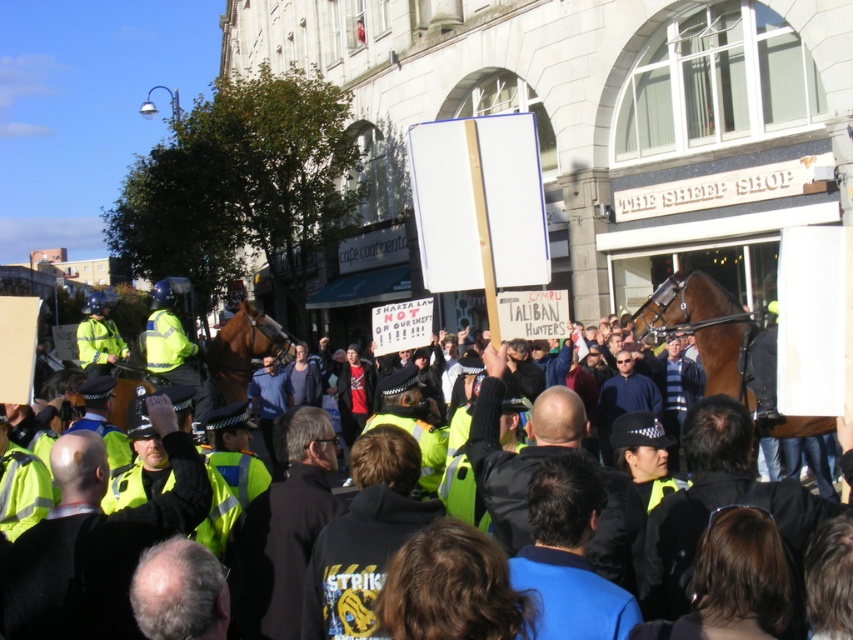
What do you see at coordinates (242, 352) in the screenshot?
I see `brown glossy horse at center` at bounding box center [242, 352].

Can you confirm if brown glossy horse at center is shorter than high-visibility yellow jacket at left?

Incorrect, brown glossy horse at center's height does not fall short of high-visibility yellow jacket at left's.

Is point (233, 392) closer to viewer compared to point (91, 312)?

Yes, it is.

This screenshot has height=640, width=853. In order to click on brown glossy horse at center in this screenshot , I will do `click(242, 352)`.

Can you confirm if dark brown leather jacket at center is positioned to the left of high-visibility yellow jacket at center-left?

In fact, dark brown leather jacket at center is to the right of high-visibility yellow jacket at center-left.

Who is more distant from viewer, (x=277, y=637) or (x=195, y=404)?

Point (x=195, y=404)

The image size is (853, 640). I want to click on dark brown leather jacket at center, so click(x=282, y=531).

Who is higher up, yellow reflective vest at center or high-visibility yellow jacket at center-left?

Positioned higher is high-visibility yellow jacket at center-left.

Is yellow reflective vest at center in front of high-visibility yellow jacket at center-left?

That is True.

What do you see at coordinates (96, 540) in the screenshot? This screenshot has width=853, height=640. I see `yellow reflective vest at center` at bounding box center [96, 540].

This screenshot has width=853, height=640. What are the coordinates of `yellow reflective vest at center` in the screenshot? It's located at (96, 540).